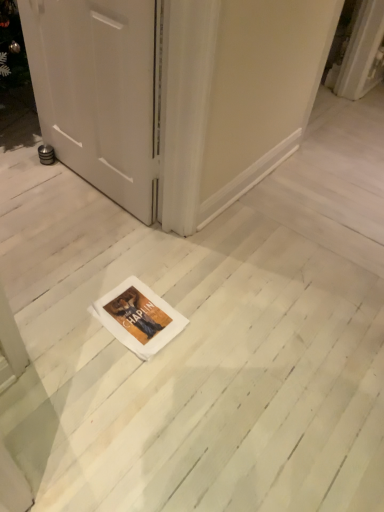
What do you see at coordinates (97, 91) in the screenshot?
I see `white matte door at center` at bounding box center [97, 91].

Locate an element on the screen. The height and width of the screenshot is (512, 384). white matte door at center is located at coordinates (97, 91).

Identify the location of white matte door at center. (97, 91).